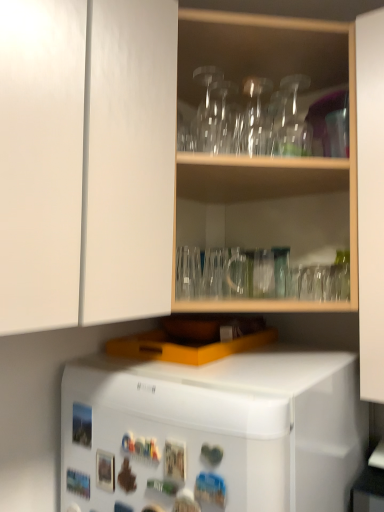
Question: In the image, is white matte refrigerator at lower center positioned in front of or behind white matte cabinet doors at upper left?

Choices:
 (A) behind
 (B) front

Answer: (A)

Question: From the image's perspective, is white matte refrigerator at lower center above or below white matte cabinet doors at upper left?

Choices:
 (A) below
 (B) above

Answer: (A)

Question: Considering the real-world distances, which object is farthest from the transparent glassware at upper center?

Choices:
 (A) transparent glass vase at upper center, which ranks as the 1th glass vase in front-to-back order
 (B) white matte refrigerator at lower center
 (C) transparent glass vase at upper center, which is the 2th glass vase from right to left
 (D) white matte cabinet doors at upper left

Answer: (B)

Question: Estimate the real-world distances between objects in this image. Which object is closer to the transparent glassware at upper center?

Choices:
 (A) transparent glass vase at upper center, arranged as the second glass vase when viewed from the back
 (B) white matte refrigerator at lower center
 (C) transparent glass vase at upper center, which is the 2th glass vase from right to left
 (D) white matte cabinet doors at upper left

Answer: (A)